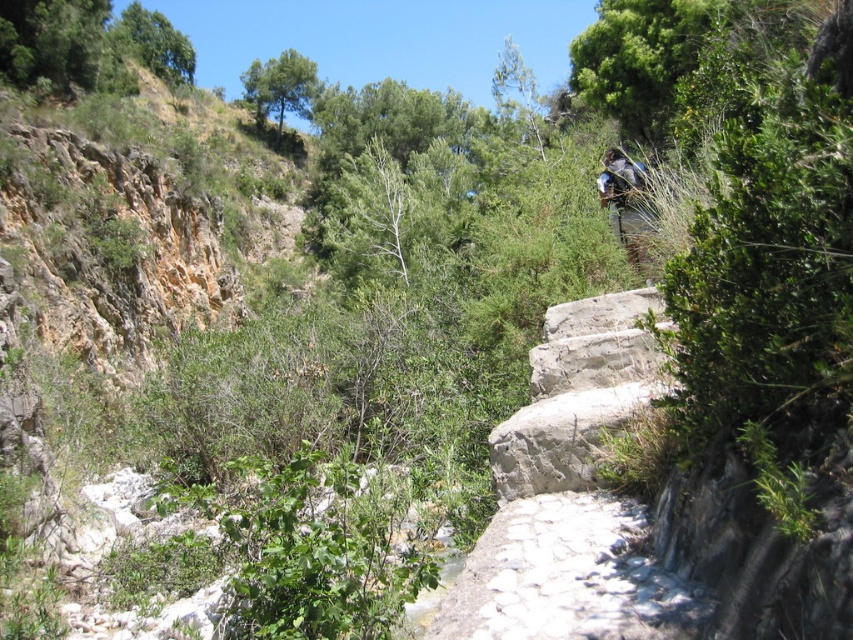
You are standing at the base of the cliff on the left side of the image. You want to reach the person on the right side. According to the image, which direction should you walk along the white stone path at center to reach the person?

You should walk towards the right along the white stone path at center to reach the person on the right side of the image.

Looking at this image, you are a hiker who wants to place your blue fabric backpack at upper right on the ground near the white stone path at center. Can you do this without moving the backpack or the path?

The white stone path at center is closer to the viewer than the blue fabric backpack at upper right, so the backpack is further away from you. To place the backpack near the path, you would need to move it closer to the path, but since you cannot move the backpack or the path, it is not possible to place them near each other without moving either object.